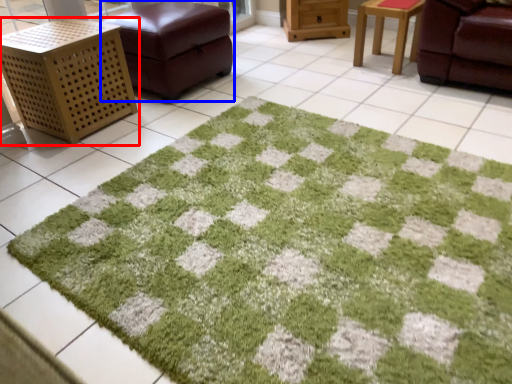
Question: Which point is closer to the camera, furniture (highlighted by a red box) or furniture (highlighted by a blue box)?

Choices:
 (A) furniture
 (B) furniture

Answer: (A)